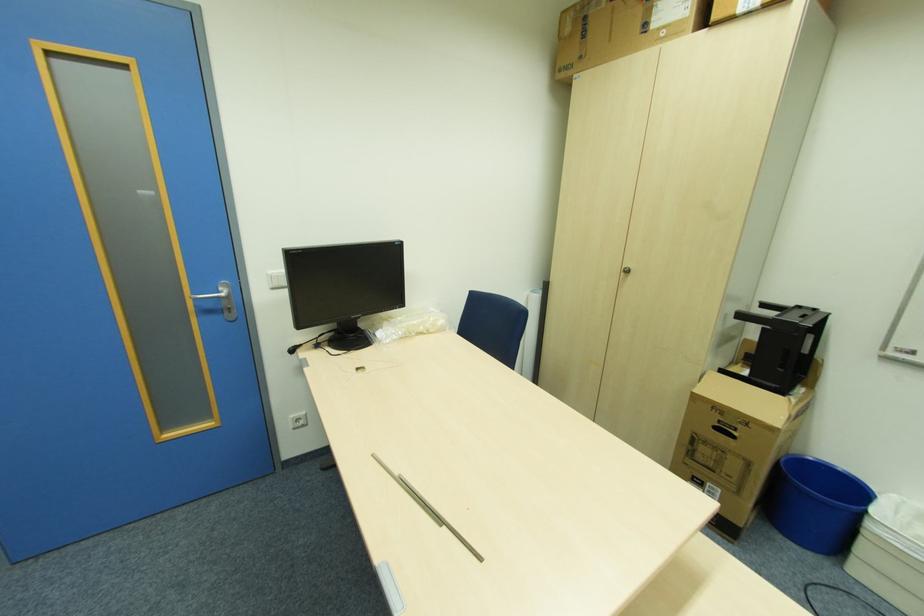
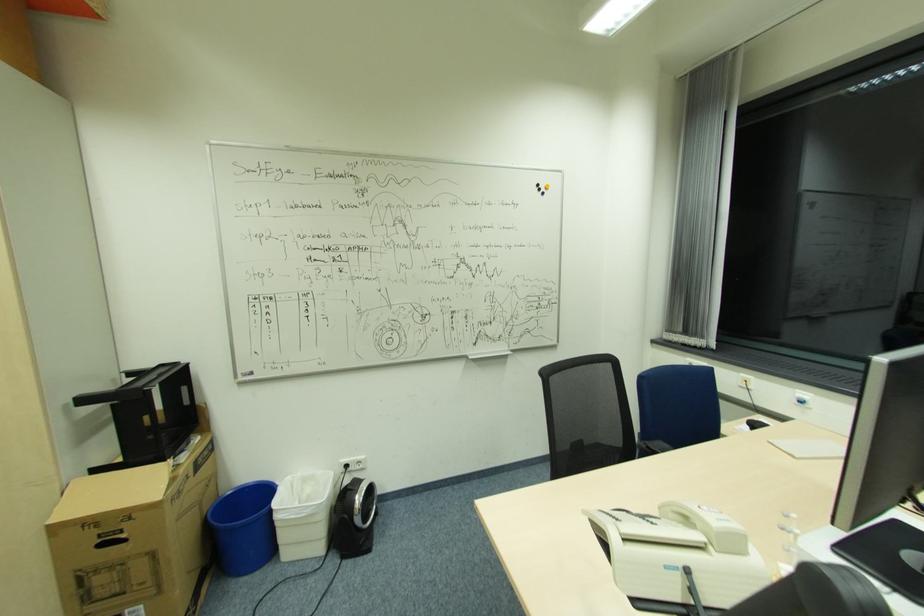
Question: The images are taken continuously from a first-person perspective. In which direction is your viewpoint rotating?

Choices:
 (A) Left
 (B) Right
 (C) Up
 (D) Down

Answer: (B)